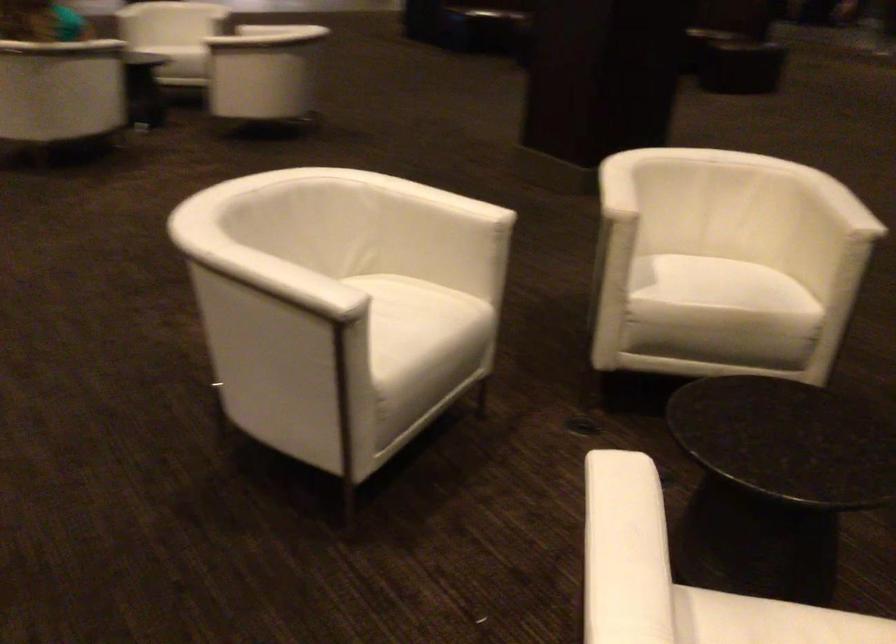
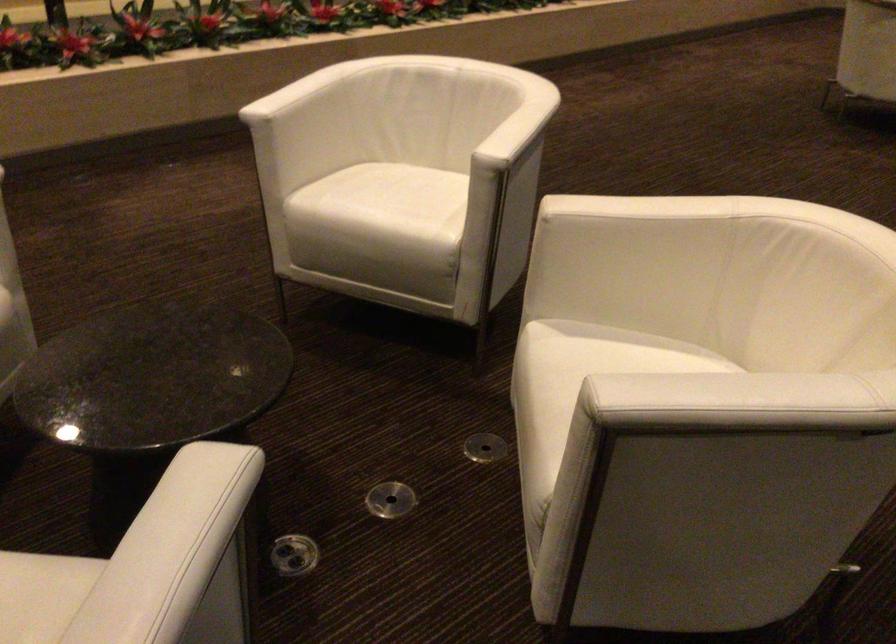
The point at (96, 305) is marked in the first image. Where is the corresponding point in the second image?

(571, 180)